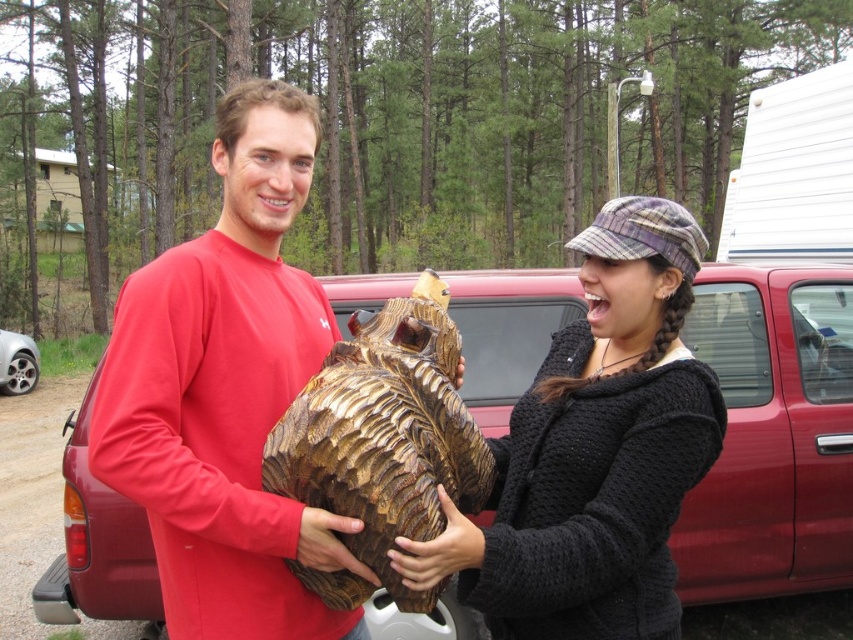
Between matte red shirt at center and silver metallic car wheel at lower left, which one has more height?

matte red shirt at center

Does matte red shirt at center have a lesser height compared to silver metallic car wheel at lower left?

No, matte red shirt at center is not shorter than silver metallic car wheel at lower left.

Is point (181, 252) in front of point (0, 381)?

Yes, point (181, 252) is closer to viewer.

Locate an element on the screen. The image size is (853, 640). matte red shirt at center is located at coordinates (225, 392).

Who is positioned more to the right, metallic red truck at center or silver metallic car wheel at lower left?

Positioned to the right is metallic red truck at center.

Does metallic red truck at center come in front of silver metallic car wheel at lower left?

That is True.

At what (x,y) coordinates should I click in order to perform the action: click on metallic red truck at center. Please return your answer as a coordinate pair (x, y). This screenshot has width=853, height=640. Looking at the image, I should click on (772, 435).

Locate an element on the screen. metallic red truck at center is located at coordinates (772, 435).

What are the coordinates of `matte red shirt at center` in the screenshot? It's located at (225, 392).

Who is lower down, matte red shirt at center or black knitted sweater at center?

black knitted sweater at center

Does point (257, 164) lie in front of point (614, 625)?

No.

I want to click on matte red shirt at center, so click(x=225, y=392).